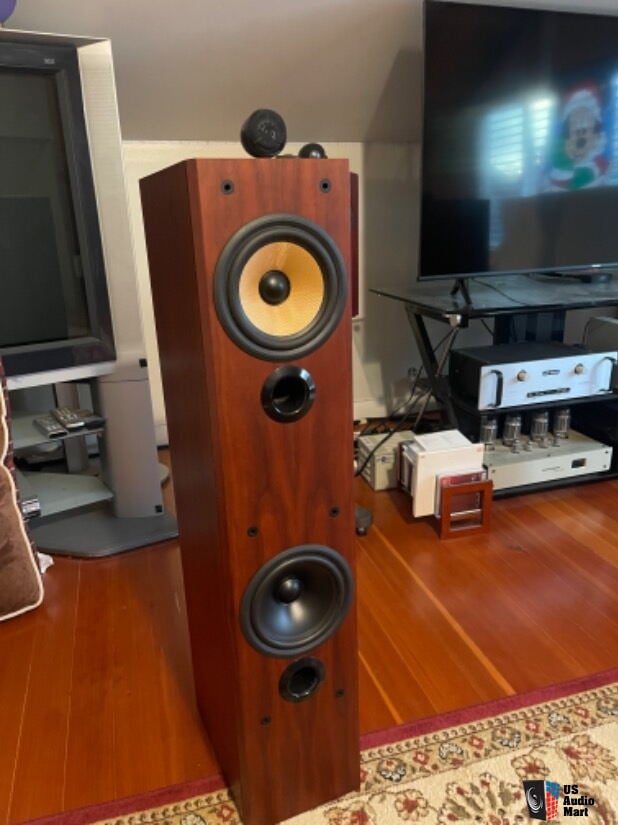
Image resolution: width=618 pixels, height=825 pixels. I want to click on wall, so click(x=389, y=247).